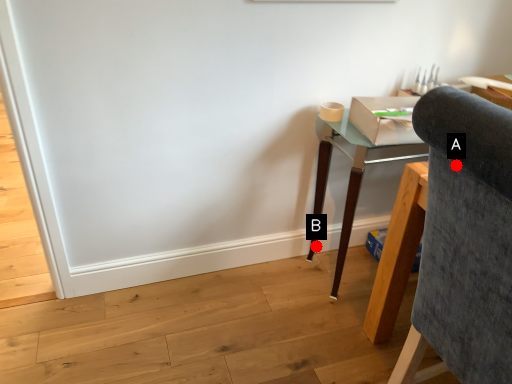
Question: Two points are circled on the image, labeled by A and B beside each circle. Among these points, which one is nearest to the camera?

Choices:
 (A) A is closer
 (B) B is closer

Answer: (A)